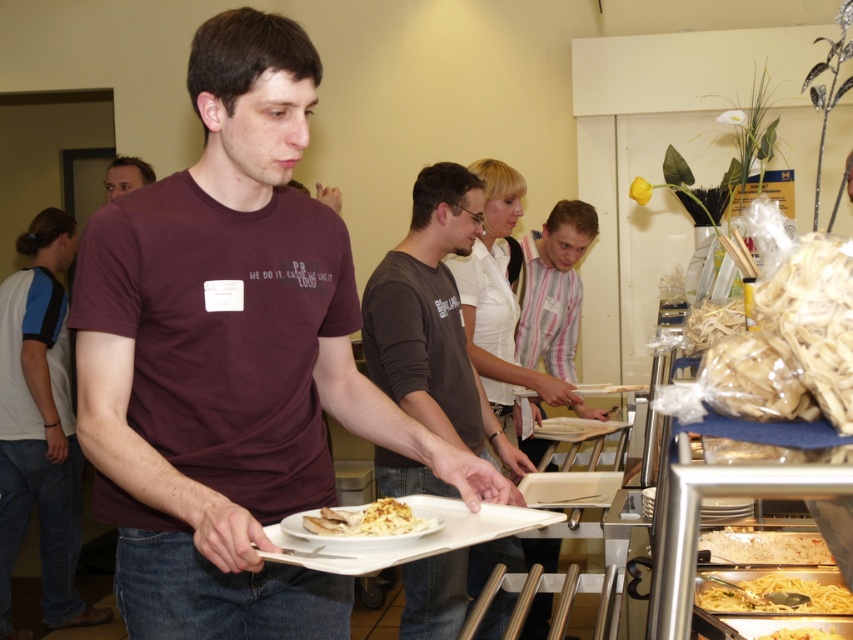
Based on the photo, you are at a buffet and want to choose between the white creamy pasta at lower right and the yellowish matte pasta at lower right. Which one is closer to you?

The white creamy pasta at lower right is closer to you because the yellowish matte pasta at lower right is behind it.

In the scene shown: You are at a buffet and want to choose between the white creamy pasta at lower right and the yellowish matte pasta at lower right. Which one is taller?

The white creamy pasta at lower right is taller than the yellowish matte pasta at lower right.